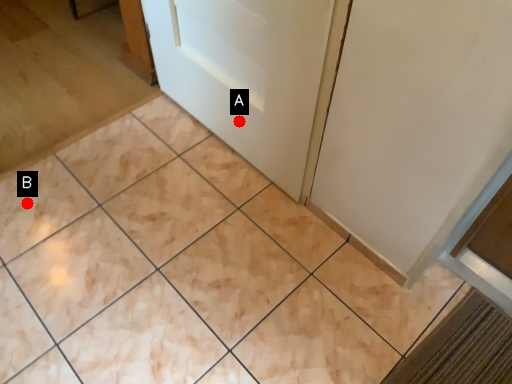
Question: Two points are circled on the image, labeled by A and B beside each circle. Which point is closer to the camera taking this photo?

Choices:
 (A) A is closer
 (B) B is closer

Answer: (B)